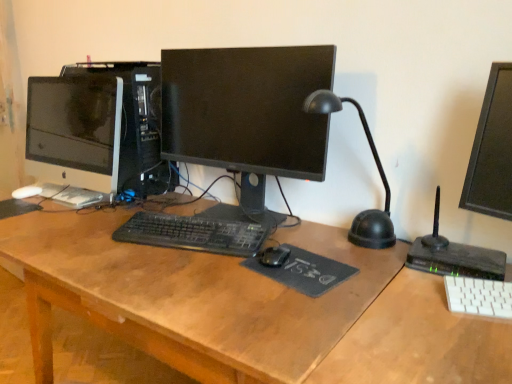
The width and height of the screenshot is (512, 384). I want to click on vacant area located to the right-hand side of black matte keyboard at center, the 1th computer keyboard when ordered from back to front, so click(x=309, y=233).